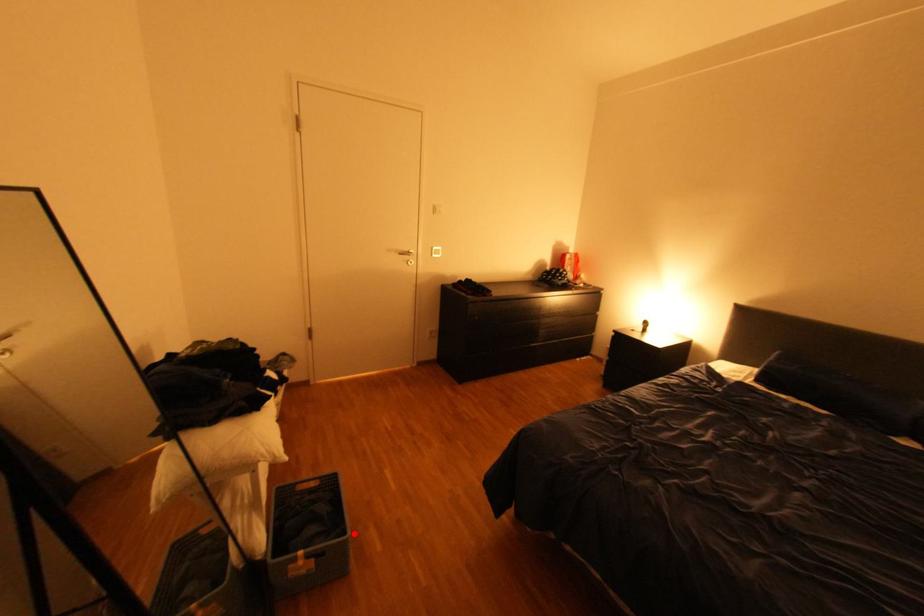
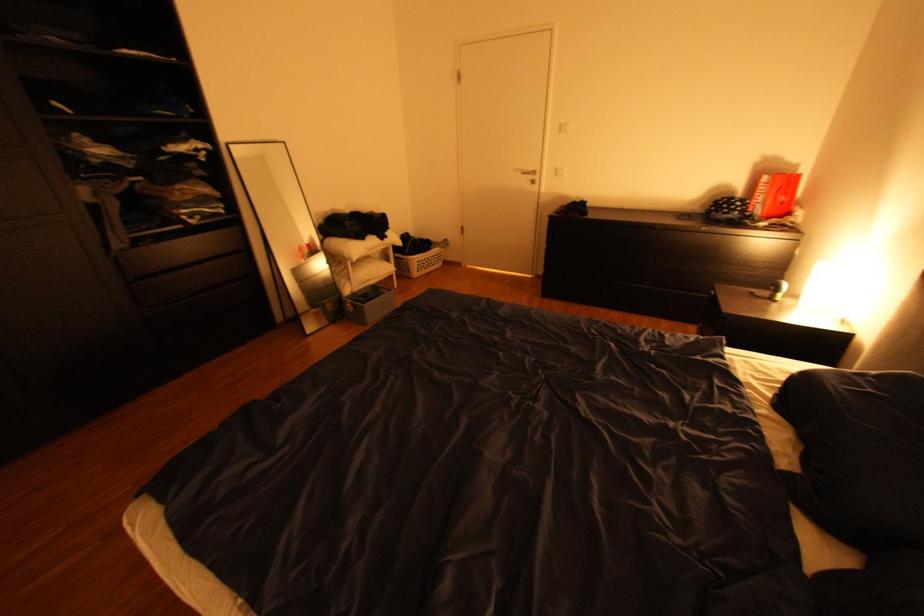
In the second image, find the point that corresponds to the highlighted location in the first image.

(373, 304)